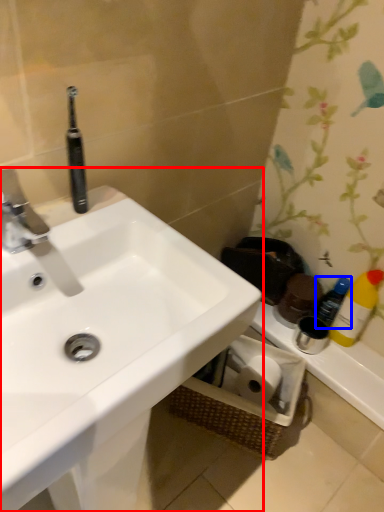
Question: Among these objects, which one is nearest to the camera, sink (highlighted by a red box) or bottle (highlighted by a blue box)?

Choices:
 (A) sink
 (B) bottle

Answer: (A)